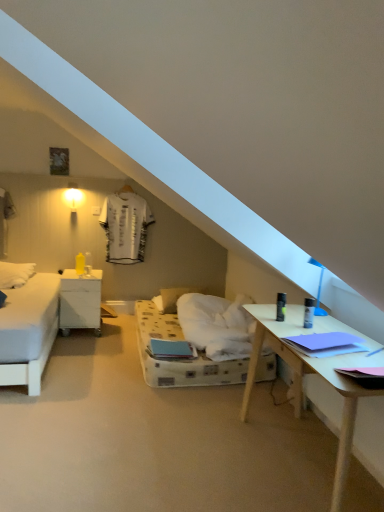
This screenshot has height=512, width=384. Describe the element at coordinates (80, 301) in the screenshot. I see `white matte nightstand at left` at that location.

In order to face white matte nightstand at left, should I rotate leftwards or rightwards?

Turn left approximately 14.443 degrees to face it.

You are a GUI agent. You are given a task and a screenshot of the screen. Output one action in this format:
    pyautogui.click(x=<x>, y=<y>)
    Task: Click on the white matte nightstand at left
    The image size is (384, 512).
    Given the screenshot: What is the action you would take?
    pyautogui.click(x=80, y=301)

What do you see at coordinates (175, 297) in the screenshot?
I see `white soft pillow at center` at bounding box center [175, 297].

Image resolution: width=384 pixels, height=512 pixels. Find the location of `white soft pillow at center`. white soft pillow at center is located at coordinates (175, 297).

Where is `white matte nightstand at left`? This screenshot has height=512, width=384. white matte nightstand at left is located at coordinates (80, 301).

Does white soft pillow at center appear on the right side of white matte nightstand at left?

Yes, white soft pillow at center is to the right of white matte nightstand at left.

Is white soft pillow at center closer to the viewer compared to white matte nightstand at left?

That is False.

Is point (164, 297) farther from viewer compared to point (99, 321)?

Yes.

From the image's perspective, is white soft pillow at center beneath white matte nightstand at left?

Yes, from the image's perspective, white soft pillow at center is below white matte nightstand at left.

From a real-world perspective, is white soft pillow at center located beneath white matte nightstand at left?

Yes.

In terms of width, does white soft pillow at center look wider or thinner when compared to white matte nightstand at left?

white soft pillow at center is thinner than white matte nightstand at left.

In the scene shown: Considering the sizes of white soft pillow at center and white matte nightstand at left in the image, is white soft pillow at center taller or shorter than white matte nightstand at left?

Clearly, white soft pillow at center is shorter compared to white matte nightstand at left.

Looking at the image, does white soft pillow at center seem bigger or smaller compared to white matte nightstand at left?

In the image, white soft pillow at center appears to be smaller than white matte nightstand at left.

Is white matte nightstand at left located within white soft pillow at center?

Actually, white matte nightstand at left is outside white soft pillow at center.

Is white soft pillow at center not close to white matte nightstand at left?

They are positioned close to each other.

Is white soft pillow at center facing away from white matte nightstand at left?

No.

Can you tell me how much white soft pillow at center and white matte nightstand at left differ in facing direction?

The angle between the facing direction of white soft pillow at center and the facing direction of white matte nightstand at left is 0.769 degrees.

You are a GUI agent. You are given a task and a screenshot of the screen. Output one action in this format:
    pyautogui.click(x=<x>, y=<y>)
    Task: Click on the pillow below the white matte nightstand at left (from the image's perspective)
    
    Given the screenshot: What is the action you would take?
    pyautogui.click(x=175, y=297)

Does white matte nightstand at left appear on the right side of white soft pillow at center?

No, white matte nightstand at left is not to the right of white soft pillow at center.

Between white matte nightstand at left and white soft pillow at center, which one is positioned in front?

white matte nightstand at left is more forward.

Does point (99, 333) appear closer or farther from the camera than point (170, 291)?

Point (99, 333) is closer to the camera than point (170, 291).

From the image's perspective, is white matte nightstand at left under white soft pillow at center?

No, from the image's perspective, white matte nightstand at left is not below white soft pillow at center.

From a real-world perspective, does white matte nightstand at left sit lower than white soft pillow at center?

No.

Looking at their sizes, would you say white matte nightstand at left is wider or thinner than white soft pillow at center?

Clearly, white matte nightstand at left has more width compared to white soft pillow at center.

Is white matte nightstand at left shorter than white soft pillow at center?

No, white matte nightstand at left is not shorter than white soft pillow at center.

Does white matte nightstand at left have a larger size compared to white soft pillow at center?

Yes.

Is white matte nightstand at left inside or outside of white soft pillow at center?

The correct answer is: outside.

Based on the photo, is white matte nightstand at left with white soft pillow at center?

No.

Is white matte nightstand at left turned away from white soft pillow at center?

white matte nightstand at left does not have its back to white soft pillow at center.

What's the angular difference between white matte nightstand at left and white soft pillow at center's facing directions?

There is a 0.769-degree angle between the facing directions of white matte nightstand at left and white soft pillow at center.

Where is `pillow below the white matte nightstand at left (from the image's perspective)`? pillow below the white matte nightstand at left (from the image's perspective) is located at coordinates (175, 297).

In order to click on nightstand above the white soft pillow at center (from the image's perspective) in this screenshot , I will do `click(80, 301)`.

Locate an element on the screen. Image resolution: width=384 pixels, height=512 pixels. pillow behind the white matte nightstand at left is located at coordinates [175, 297].